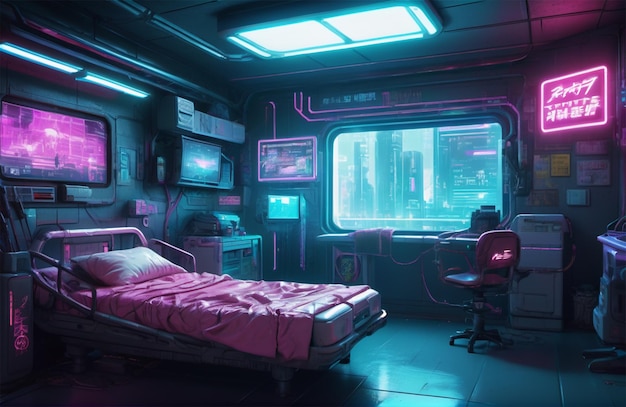
This screenshot has height=407, width=626. In order to click on back of chair in this screenshot , I will do `click(495, 250)`.